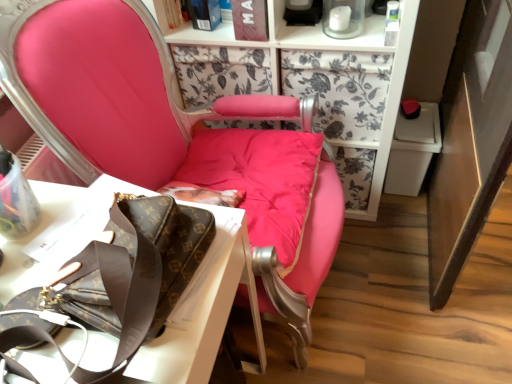
The height and width of the screenshot is (384, 512). What do you see at coordinates (198, 312) in the screenshot?
I see `white paper at upper left` at bounding box center [198, 312].

Measure the distance between point (113, 186) and camera.

The distance of point (113, 186) from camera is 33.23 inches.

Identify the location of white paper at upper left. (198, 312).

What is the approximate height of matte pink cushion at center?

matte pink cushion at center is 3.45 feet tall.

The image size is (512, 384). Describe the element at coordinates (110, 88) in the screenshot. I see `matte pink cushion at center` at that location.

The image size is (512, 384). In order to click on matte pink cushion at center in this screenshot , I will do `click(110, 88)`.

Image resolution: width=512 pixels, height=384 pixels. I want to click on white paper at upper left, so click(x=198, y=312).

Can you confirm if matte pink cushion at center is positioned to the left of white paper at upper left?

In fact, matte pink cushion at center is to the right of white paper at upper left.

Is matte pink cushion at center further to camera compared to white paper at upper left?

No, the depth of matte pink cushion at center is less than that of white paper at upper left.

Is point (105, 132) positioned before point (195, 341)?

No, it is behind (195, 341).

From the image's perspective, does matte pink cushion at center appear lower than white paper at upper left?

No, from the image's perspective, matte pink cushion at center is not beneath white paper at upper left.

From a real-world perspective, who is located higher, matte pink cushion at center or white paper at upper left?

matte pink cushion at center, from a real-world perspective.

Can you confirm if matte pink cushion at center is thinner than white paper at upper left?

Incorrect, the width of matte pink cushion at center is not less than that of white paper at upper left.

Does matte pink cushion at center have a lesser height compared to white paper at upper left?

No.

Which of these two, matte pink cushion at center or white paper at upper left, is smaller?

With smaller size is white paper at upper left.

Is matte pink cushion at center positioned beyond the bounds of white paper at upper left?

matte pink cushion at center lies outside white paper at upper left's area.

Would you consider matte pink cushion at center to be distant from white paper at upper left?

No, matte pink cushion at center is not far from white paper at upper left.

Is matte pink cushion at center turned away from white paper at upper left?

No, matte pink cushion at center is not facing away from white paper at upper left.

Identify the location of desk directly beneath the matte pink cushion at center (from a real-world perspective). This screenshot has width=512, height=384. (198, 312).

Can you confirm if white paper at upper left is positioned to the right of matte pink cushion at center?

In fact, white paper at upper left is to the left of matte pink cushion at center.

Which object is more forward, white paper at upper left or matte pink cushion at center?

matte pink cushion at center is in front.

Is point (154, 341) positioned in front of point (128, 71)?

That is True.

From the image's perspective, who appears lower, white paper at upper left or matte pink cushion at center?

white paper at upper left appears lower in the image.

From a real-world perspective, does white paper at upper left stand above matte pink cushion at center?

Incorrect, from a real-world perspective, white paper at upper left is lower than matte pink cushion at center.

Considering the relative sizes of white paper at upper left and matte pink cushion at center in the image provided, is white paper at upper left thinner than matte pink cushion at center?

Yes.

Is white paper at upper left shorter than matte pink cushion at center?

Yes, white paper at upper left is shorter than matte pink cushion at center.

In the scene shown: Who is bigger, white paper at upper left or matte pink cushion at center?

Bigger between the two is matte pink cushion at center.

Is white paper at upper left spatially inside matte pink cushion at center, or outside of it?

white paper at upper left is located beyond the bounds of matte pink cushion at center.

Is white paper at upper left touching matte pink cushion at center?

white paper at upper left is not next to matte pink cushion at center, and they're not touching.

Is matte pink cushion at center at the back of white paper at upper left?

No.

Measure the distance from white paper at upper left to matte pink cushion at center.

The distance of white paper at upper left from matte pink cushion at center is 12.33 inches.

What are the coordinates of `chair above the white paper at upper left (from the image's perspective)` in the screenshot? It's located at (110, 88).

Image resolution: width=512 pixels, height=384 pixels. Find the location of `desk behind the matte pink cushion at center`. desk behind the matte pink cushion at center is located at coordinates (198, 312).

Where is `chair above the white paper at upper left (from a real-world perspective)`? The height and width of the screenshot is (384, 512). chair above the white paper at upper left (from a real-world perspective) is located at coordinates (110, 88).